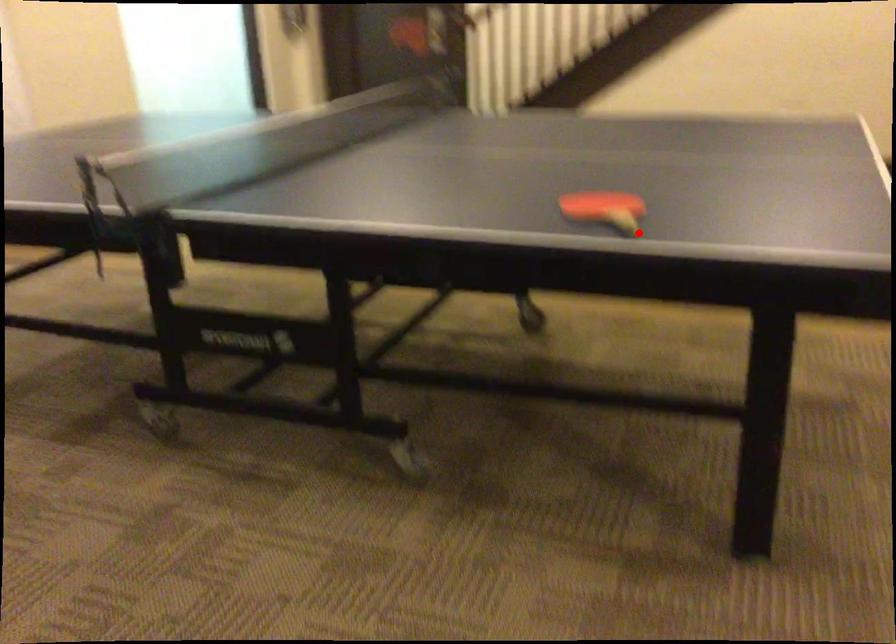
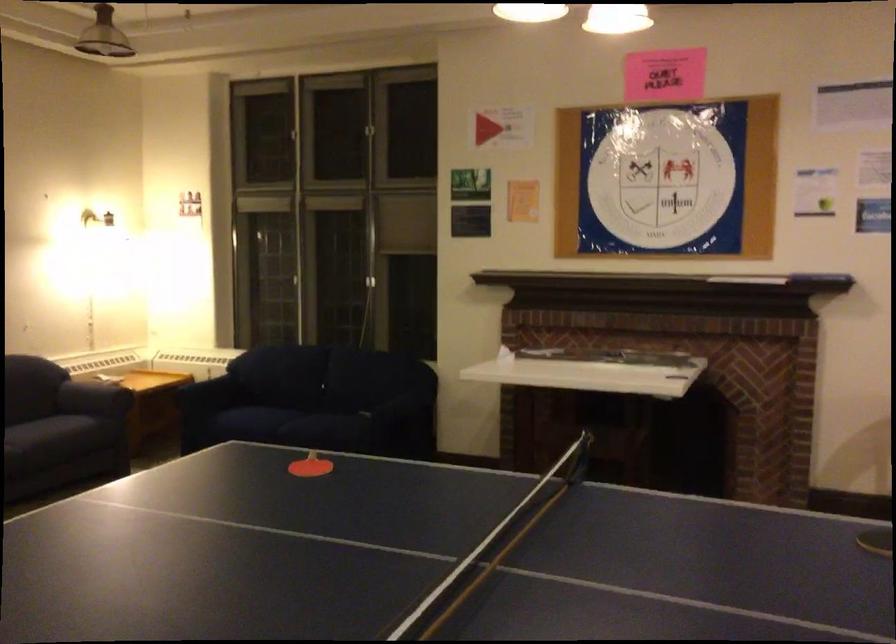
Locate, in the second image, the point that corresponds to the highlighted location in the first image.

(309, 466)